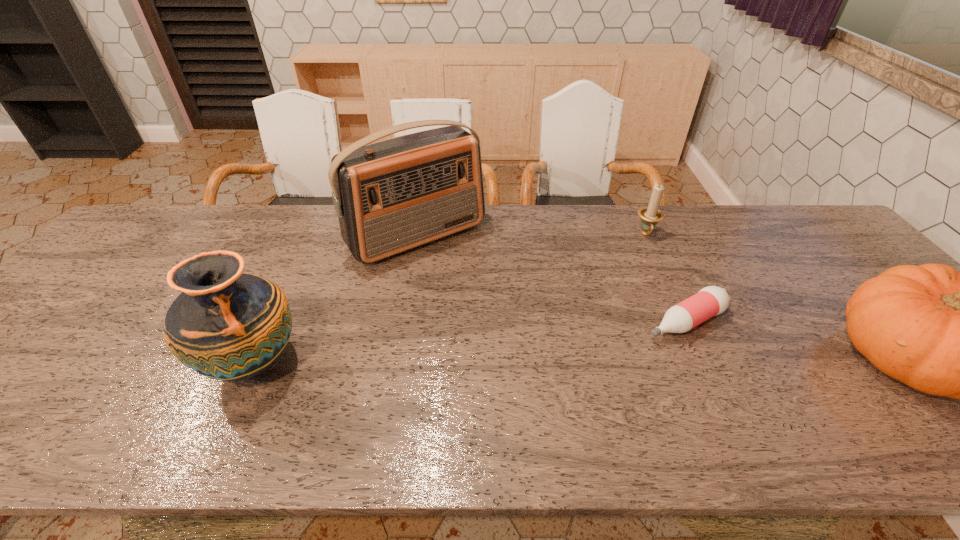
Locate an element on the screen. vacant space located 0.250m with the cap open on the bottle is located at coordinates (571, 379).

Where is `free space located 0.280m with the cap open on the bottle`? free space located 0.280m with the cap open on the bottle is located at coordinates (561, 385).

This screenshot has height=540, width=960. What are the coordinates of `blank space located with the cap open on the bottle` in the screenshot? It's located at (599, 363).

Locate an element on the screen. vacant region located on the handle side of the fourth tallest object is located at coordinates pyautogui.click(x=658, y=287).

Identify the location of free space located 0.050m on the handle side of the fourth tallest object. (651, 254).

The width and height of the screenshot is (960, 540). Identify the location of vacant space located 0.300m on the handle side of the fourth tallest object. (664, 316).

Find the location of a particular element. radio receiver that is at the far edge is located at coordinates (391, 196).

Identify the location of candle_holder located in the far edge section of the desktop. The width and height of the screenshot is (960, 540). (650, 216).

Find the location of a particular element. The height and width of the screenshot is (540, 960). object situated at the near edge is located at coordinates (230, 326).

This screenshot has width=960, height=540. Identify the location of free space at the far edge. (700, 234).